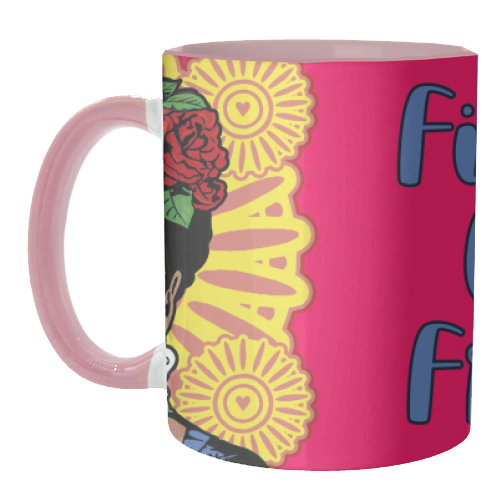
Locate an element on the screen. This screenshot has height=500, width=500. pink and yellow mug is located at coordinates (311, 269), (258, 254).